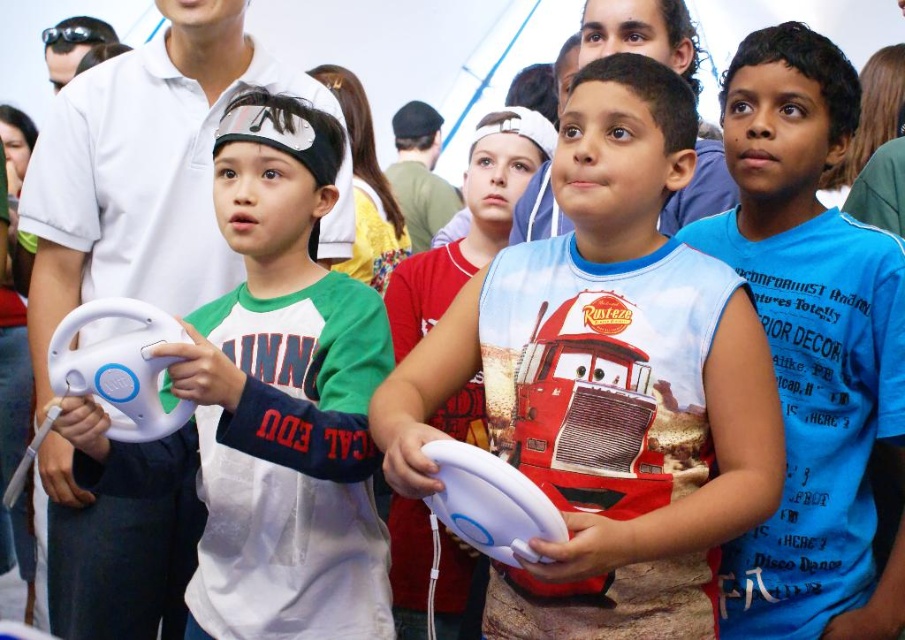
Can you confirm if white matte controller at center is positioned below blue cotton shirt at center?

No, white matte controller at center is not below blue cotton shirt at center.

Which is below, white matte controller at center or blue cotton shirt at center?

blue cotton shirt at center is below.

Between point (627, 234) and point (763, 580), which one is positioned behind?

The point (763, 580) is behind.

This screenshot has height=640, width=905. I want to click on white matte controller at center, so (x=607, y=381).

Can you confirm if white matte steering wheel at left is bigger than blue cotton shirt at center?

Yes, white matte steering wheel at left is bigger than blue cotton shirt at center.

Who is more forward, (249, 461) or (901, 440)?

Point (901, 440) is in front.

You are a GUI agent. You are given a task and a screenshot of the screen. Output one action in this format:
    pyautogui.click(x=<x>, y=<y>)
    Task: Click on the white matte steering wheel at left
    This screenshot has height=640, width=905.
    Given the screenshot: What is the action you would take?
    pyautogui.click(x=270, y=403)

Between white matte controller at center and white matte steering wheel at left, which one appears on the left side from the viewer's perspective?

From the viewer's perspective, white matte steering wheel at left appears more on the left side.

Does white matte controller at center appear over white matte steering wheel at left?

Indeed, white matte controller at center is positioned over white matte steering wheel at left.

Is point (625, 506) more distant than point (210, 432)?

No, it is in front of (210, 432).

Find the location of a particular element. The image size is (905, 640). white matte controller at center is located at coordinates (607, 381).